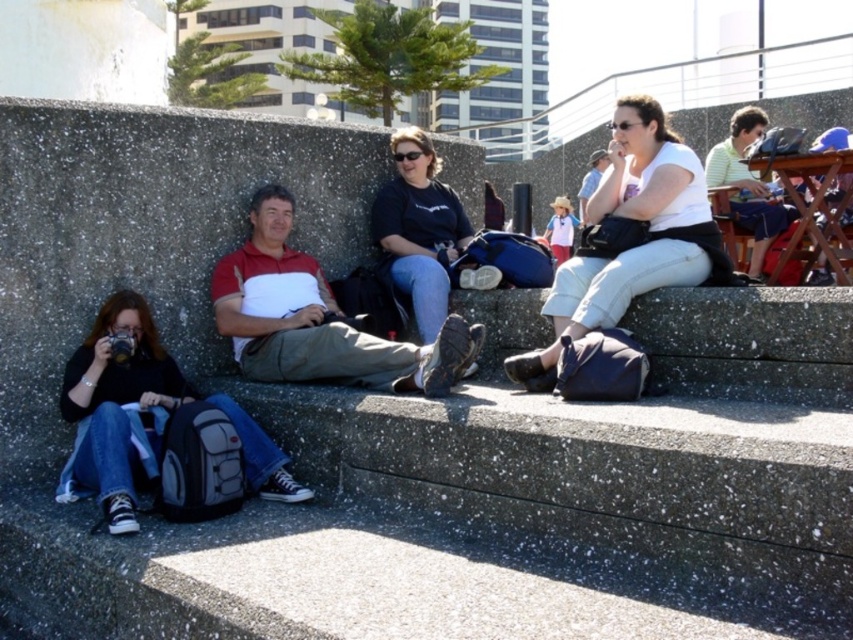
Question: Which of the following is the closest to the observer?

Choices:
 (A) matte white shirt at center
 (B) black matte shirt at center
 (C) white matte shirt at upper right

Answer: (C)

Question: Considering the relative positions of denim jeans at lower left and matte white shirt at center in the image provided, where is denim jeans at lower left located with respect to matte white shirt at center?

Choices:
 (A) below
 (B) above

Answer: (A)

Question: Is denim jeans at lower left positioned in front of black matte shirt at center?

Choices:
 (A) no
 (B) yes

Answer: (B)

Question: Which object is the closest to the black matte shirt at center?

Choices:
 (A) matte white shirt at center
 (B) white matte shirt at upper right

Answer: (B)

Question: Observing the image, what is the correct spatial positioning of denim jeans at lower left in reference to matte white shirt at center?

Choices:
 (A) below
 (B) above

Answer: (A)

Question: Which object is the farthest from the matte white shirt at center?

Choices:
 (A) denim jeans at lower left
 (B) black matte shirt at center
 (C) white matte shirt at upper right

Answer: (C)